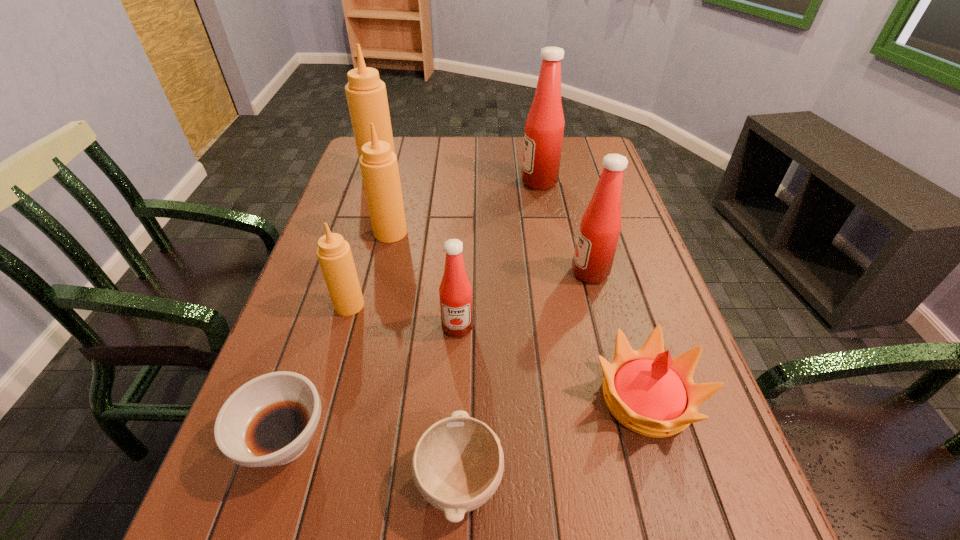
Locate an element on the screen. The height and width of the screenshot is (540, 960). the second closest red condiment to the bowl is located at coordinates (600, 227).

Locate an element on the screen. Image resolution: width=960 pixels, height=540 pixels. tan condiment that is the nearest to the smallest tan condiment is located at coordinates (379, 167).

In order to click on tan condiment identified as the second closest to the leftmost red condiment in this screenshot , I will do `click(379, 167)`.

You are a GUI agent. You are given a task and a screenshot of the screen. Output one action in this format:
    pyautogui.click(x=<x>, y=<y>)
    Task: Click on the vacant area that satisfies the following two spatial constraints: 1. on the front-facing side of the yellow crown; 2. on the right side of the biggest red condiment
    The image size is (960, 540).
    Given the screenshot: What is the action you would take?
    578,399

Locate an element on the screen. free point that satisfies the following two spatial constraints: 1. on the front-facing side of the farthest red condiment; 2. on the front side of the second farthest tan condiment is located at coordinates (548, 233).

Find the location of a particular element. The height and width of the screenshot is (540, 960). vacant space that satisfies the following two spatial constraints: 1. on the front-facing side of the biggest red condiment; 2. on the front-facing side of the smallest red condiment is located at coordinates (565, 327).

Locate an element on the screen. This screenshot has width=960, height=540. vacant space that satisfies the following two spatial constraints: 1. on the back side of the yellow crown; 2. on the front-facing side of the biggest red condiment is located at coordinates (580, 181).